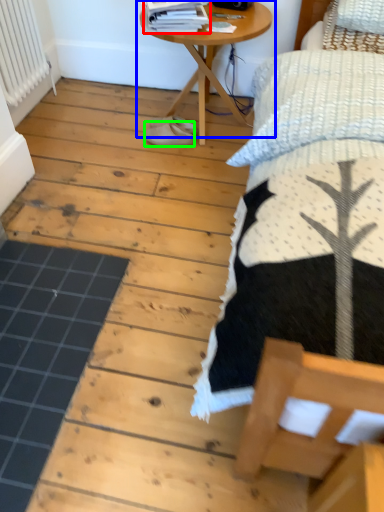
Question: Considering the real-world distances, which object is farthest from magazine (highlighted by a red box)? table (highlighted by a blue box) or footwear (highlighted by a green box)?

Choices:
 (A) table
 (B) footwear

Answer: (B)